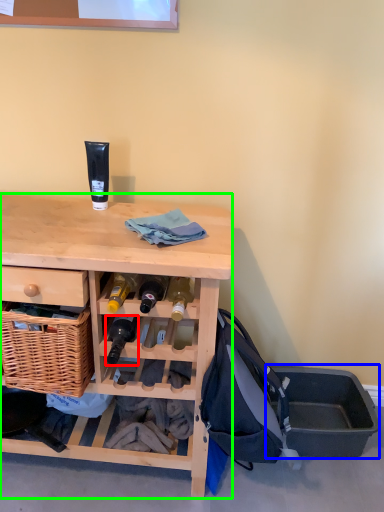
Question: Which is farther away from bottle (highlighted by a red box)? storage box (highlighted by a blue box) or desk (highlighted by a green box)?

Choices:
 (A) storage box
 (B) desk

Answer: (A)